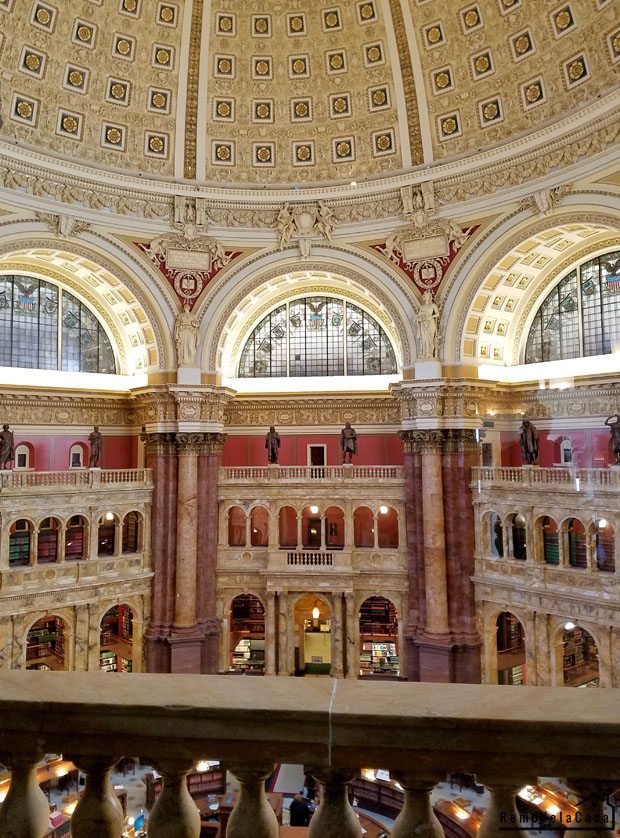
Where is `arched window`? The height and width of the screenshot is (838, 620). arched window is located at coordinates (315, 344), (4, 337), (596, 311).